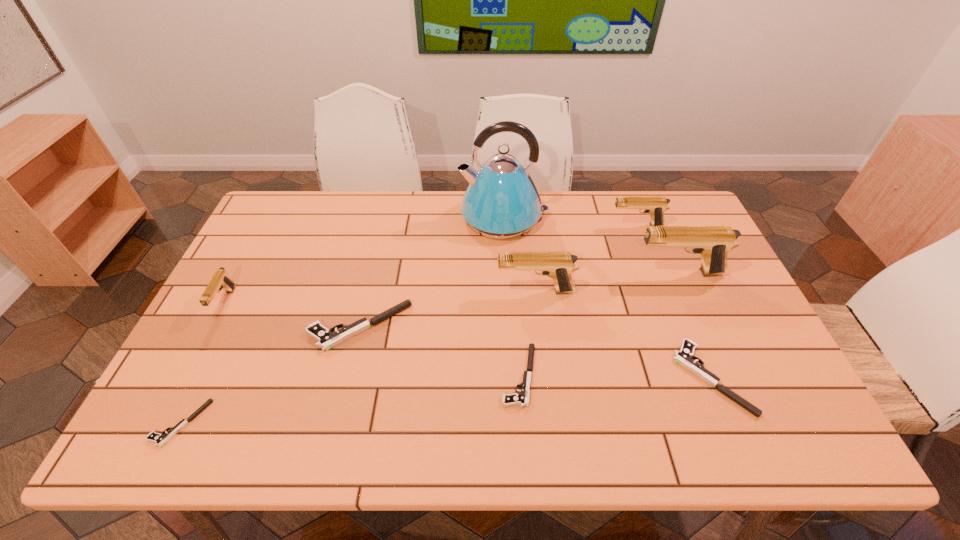
Find the location of a particular element. the tallest object is located at coordinates (501, 202).

What are the coordinates of `the seventh nearest pistol` in the screenshot? It's located at (712, 243).

Identify the location of the tallest pistol. (712, 243).

This screenshot has height=540, width=960. Identify the location of the seventh shortest pistol. (557, 265).

Find the location of `the seventh shortest object`. the seventh shortest object is located at coordinates (557, 265).

This screenshot has height=540, width=960. In order to click on the farthest pistol in this screenshot , I will do `click(654, 206)`.

This screenshot has width=960, height=540. I want to click on the second smallest tan pistol, so click(x=654, y=206).

The image size is (960, 540). I want to click on the fifth shortest object, so click(x=220, y=280).

The height and width of the screenshot is (540, 960). Identify the location of the fifth shortest pistol. (220, 280).

In order to click on the sixth tallest object in this screenshot , I will do `click(326, 338)`.